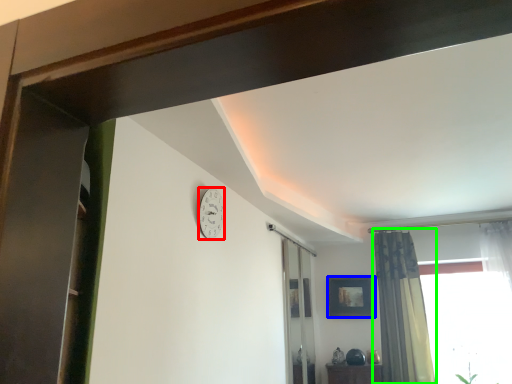
Question: Based on their relative distances, which object is farther from clock (highlighted by a red box)? Choose from picture frame (highlighted by a blue box) and curtain (highlighted by a green box).

Choices:
 (A) picture frame
 (B) curtain

Answer: (A)